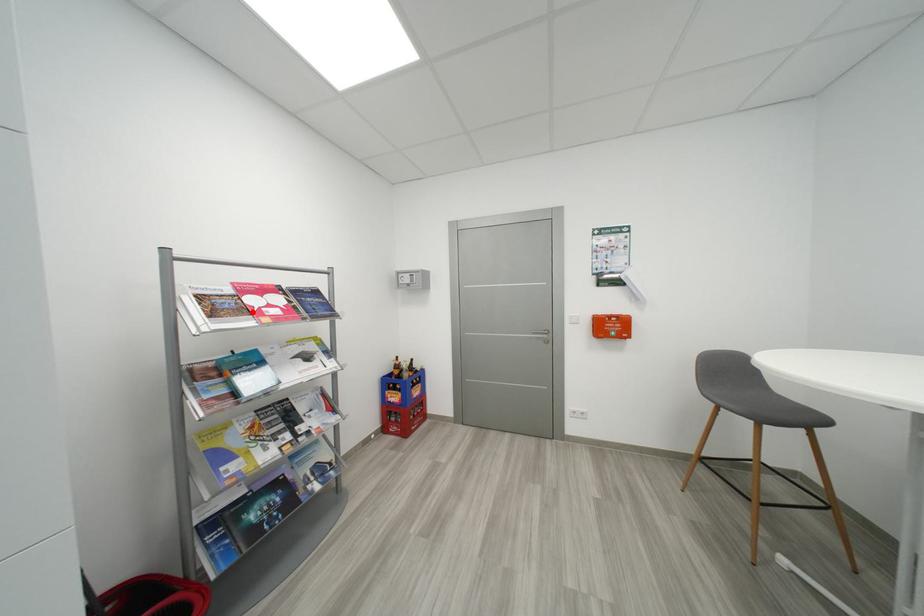
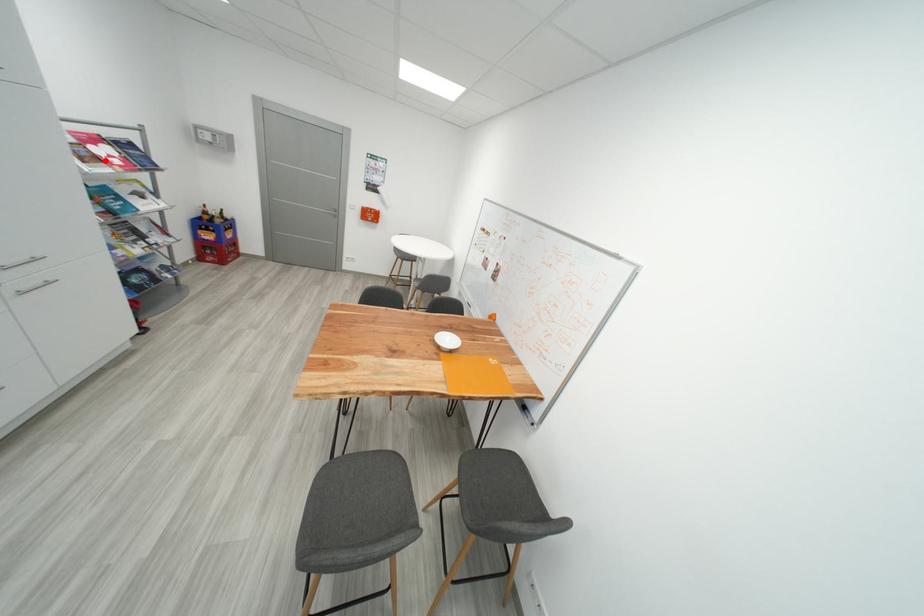
I am providing you with two images of the same scene from different viewpoints. A red point is marked on the first image and another point is marked on the second image. Does the point marked in image1 correspond to the same location as the one in image2?

Yes